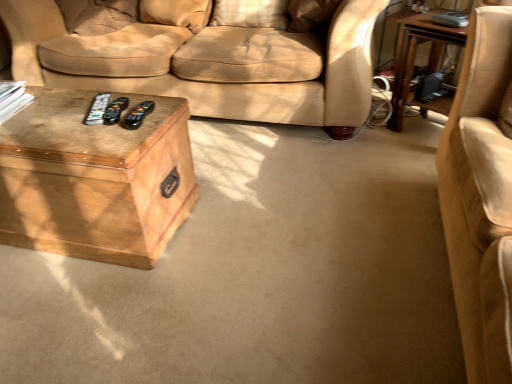
Locate an element on the screen. free space to the right of black plastic remote at center, marked as the 3th remote in a right-to-left arrangement is located at coordinates (153, 106).